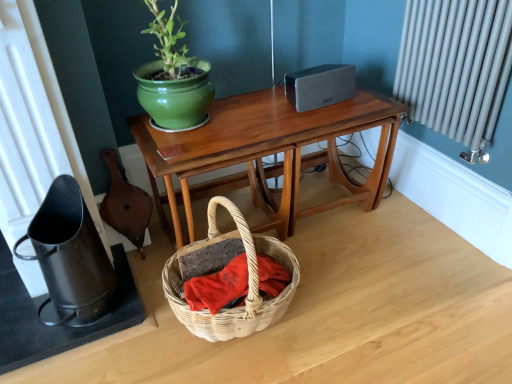
Question: Considering the relative sizes of woven wicker basket at lower center and wooden table at center in the image provided, is woven wicker basket at lower center bigger than wooden table at center?

Choices:
 (A) yes
 (B) no

Answer: (B)

Question: Could you tell me if woven wicker basket at lower center is facing wooden table at center?

Choices:
 (A) yes
 (B) no

Answer: (B)

Question: Considering the relative positions of woven wicker basket at lower center and wooden table at center in the image provided, is woven wicker basket at lower center to the right of wooden table at center from the viewer's perspective?

Choices:
 (A) yes
 (B) no

Answer: (B)

Question: From a real-world perspective, is woven wicker basket at lower center beneath wooden table at center?

Choices:
 (A) no
 (B) yes

Answer: (B)

Question: Is woven wicker basket at lower center to the left of wooden table at center from the viewer's perspective?

Choices:
 (A) no
 (B) yes

Answer: (B)

Question: From the image's perspective, is woven wicker basket at lower center above wooden table at center?

Choices:
 (A) yes
 (B) no

Answer: (B)

Question: Does wooden table at center turn towards woven wicker basket at lower center?

Choices:
 (A) yes
 (B) no

Answer: (A)

Question: Is wooden table at center thinner than woven wicker basket at lower center?

Choices:
 (A) no
 (B) yes

Answer: (A)

Question: From a real-world perspective, is wooden table at center positioned over woven wicker basket at lower center based on gravity?

Choices:
 (A) yes
 (B) no

Answer: (A)

Question: Is woven wicker basket at lower center at the back of wooden table at center?

Choices:
 (A) yes
 (B) no

Answer: (B)

Question: Can you confirm if wooden table at center is taller than woven wicker basket at lower center?

Choices:
 (A) no
 (B) yes

Answer: (B)

Question: From a real-world perspective, is wooden table at center positioned under woven wicker basket at lower center based on gravity?

Choices:
 (A) no
 (B) yes

Answer: (A)

Question: From a real-world perspective, relative to wooden table at center, is woven wicker basket at lower center vertically above or below?

Choices:
 (A) above
 (B) below

Answer: (B)